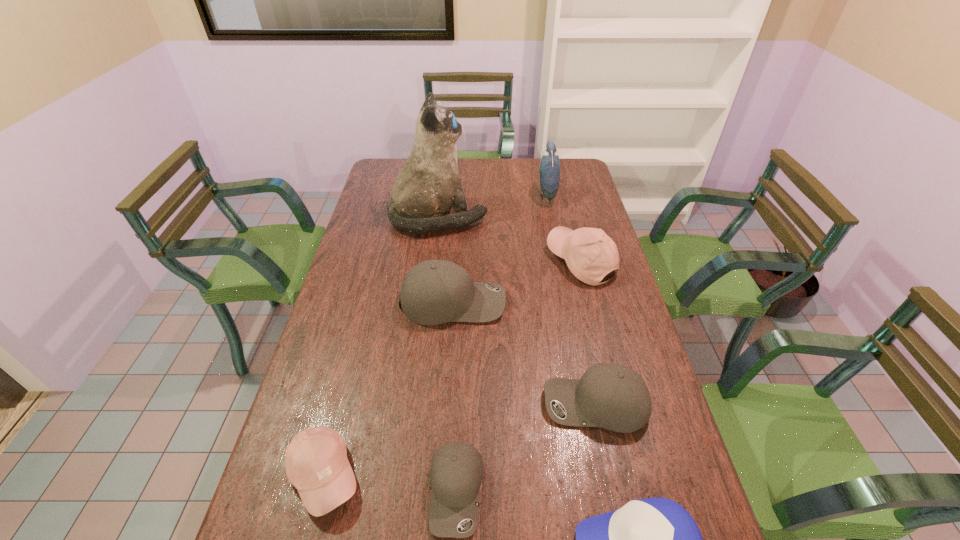
Image resolution: width=960 pixels, height=540 pixels. Find the location of `free space located 0.120m on the front brim of the second farthest gray baseball cap`. free space located 0.120m on the front brim of the second farthest gray baseball cap is located at coordinates (496, 405).

Find the location of a particular element. blank area located on the front-facing side of the nearer pink baseball cap is located at coordinates (397, 475).

Find the location of a particular element. This screenshot has width=960, height=540. object that is positioned at the far edge is located at coordinates (549, 170).

Image resolution: width=960 pixels, height=540 pixels. I want to click on cat present at the left edge, so click(429, 184).

The image size is (960, 540). I want to click on baseball cap located at the left edge, so click(x=316, y=462).

Image resolution: width=960 pixels, height=540 pixels. Identify the location of bird located at the right edge. (549, 170).

The image size is (960, 540). Identify the location of object that is at the far right corner. (549, 170).

This screenshot has width=960, height=540. Identify the location of free region at the left edge of the desktop. (379, 214).

The image size is (960, 540). Find the location of `vacant space at the right edge of the desktop`. vacant space at the right edge of the desktop is located at coordinates (594, 222).

Identify the location of vacant area that lies between the left pink baseball cap and the farthest gray baseball cap. Image resolution: width=960 pixels, height=540 pixels. (389, 388).